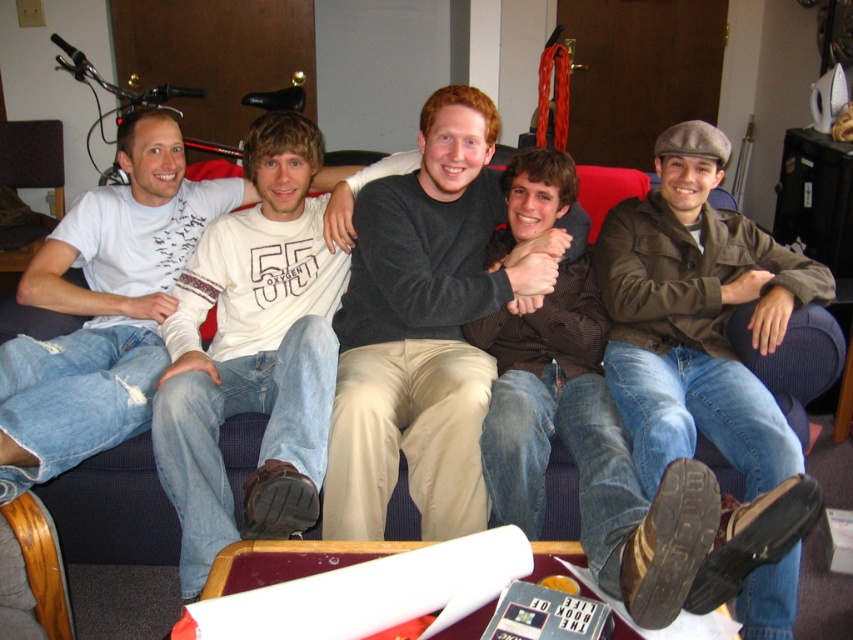
Question: Estimate the real-world distances between objects in this image. Which object is farther from the brown textured shirt at center?

Choices:
 (A) brown leather jacket at right
 (B) white cotton shirt at center
 (C) denim jeans at left
 (D) dark gray sweater at center

Answer: (C)

Question: Is white cotton shirt at center to the left of denim jeans at left from the viewer's perspective?

Choices:
 (A) yes
 (B) no

Answer: (B)

Question: Among these points, which one is farthest from the camera?

Choices:
 (A) (158, 355)
 (B) (393, 244)
 (C) (640, 369)
 (D) (309, 372)

Answer: (A)

Question: Is brown textured shirt at center above denim jeans at left?

Choices:
 (A) yes
 (B) no

Answer: (B)

Question: Among these objects, which one is farthest from the camera?

Choices:
 (A) brown textured shirt at center
 (B) brown leather jacket at right

Answer: (B)

Question: Considering the relative positions of brown leather jacket at right and brown textured shirt at center in the image provided, where is brown leather jacket at right located with respect to brown textured shirt at center?

Choices:
 (A) below
 (B) above

Answer: (B)